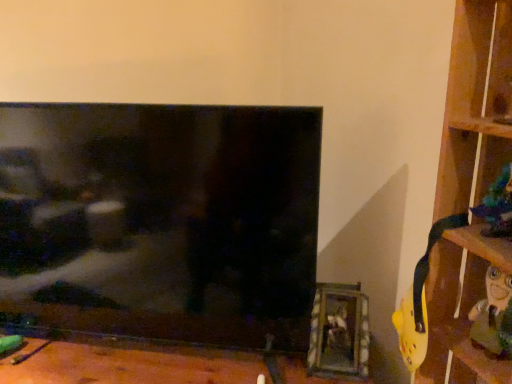
Question: Is the depth of black glossy tv at center greater than that of wooden at right?

Choices:
 (A) no
 (B) yes

Answer: (B)

Question: Is black glossy tv at center aimed at wooden at right?

Choices:
 (A) yes
 (B) no

Answer: (B)

Question: Is black glossy tv at center closer to the viewer compared to wooden at right?

Choices:
 (A) no
 (B) yes

Answer: (A)

Question: From a real-world perspective, is black glossy tv at center located higher than wooden at right?

Choices:
 (A) no
 (B) yes

Answer: (A)

Question: Considering the relative sizes of black glossy tv at center and wooden at right in the image provided, is black glossy tv at center shorter than wooden at right?

Choices:
 (A) no
 (B) yes

Answer: (B)

Question: Considering their positions, is wooden picture frame at lower right located in front of or behind wooden at right?

Choices:
 (A) behind
 (B) front

Answer: (A)

Question: In terms of size, does wooden picture frame at lower right appear bigger or smaller than wooden at right?

Choices:
 (A) big
 (B) small

Answer: (B)

Question: Considering the positions of point (333, 332) and point (510, 261), is point (333, 332) closer or farther from the camera than point (510, 261)?

Choices:
 (A) closer
 (B) farther

Answer: (B)

Question: Looking at their shapes, would you say wooden picture frame at lower right is wider or thinner than wooden at right?

Choices:
 (A) thin
 (B) wide

Answer: (A)

Question: Is black glossy tv at center taller or shorter than wooden at right?

Choices:
 (A) tall
 (B) short

Answer: (B)

Question: Does point (308, 231) appear closer or farther from the camera than point (470, 132)?

Choices:
 (A) closer
 (B) farther

Answer: (B)

Question: Considering their positions, is black glossy tv at center located in front of or behind wooden at right?

Choices:
 (A) front
 (B) behind

Answer: (B)

Question: Looking at their shapes, would you say black glossy tv at center is wider or thinner than wooden at right?

Choices:
 (A) wide
 (B) thin

Answer: (B)

Question: Is black glossy tv at center bigger or smaller than shiny blue figurine at right?

Choices:
 (A) small
 (B) big

Answer: (B)

Question: Relative to shiny blue figurine at right, is black glossy tv at center in front or behind?

Choices:
 (A) front
 (B) behind

Answer: (B)